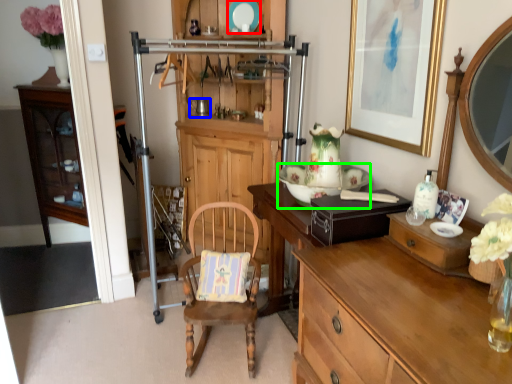
Question: Considering the real-world distances, which object is farthest from plate (highlighted by a red box)? coffee cup (highlighted by a blue box) or plate (highlighted by a green box)?

Choices:
 (A) coffee cup
 (B) plate

Answer: (B)